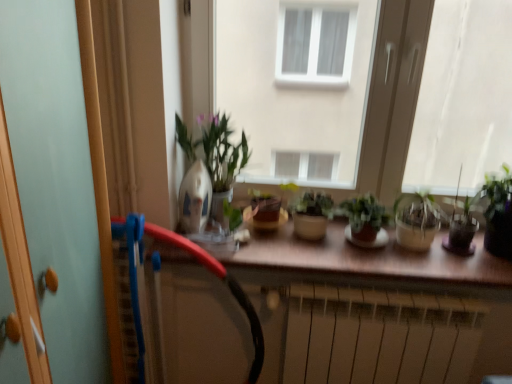
What are the coordinates of `free space underneath green matte plant at center, which is counted as the third houseplant, starting from the right (from a real-world perspective)` in the screenshot? It's located at (361, 244).